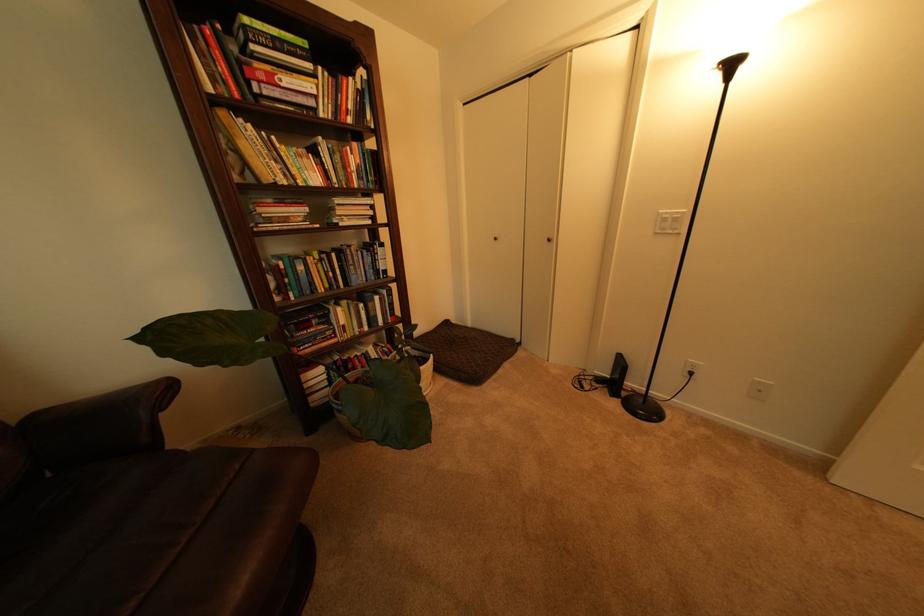
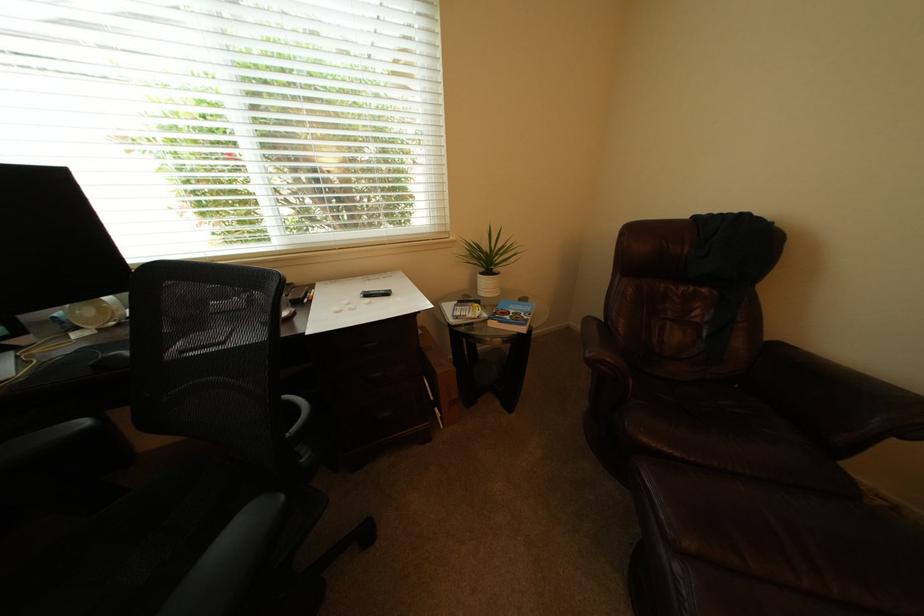
The images are taken continuously from a first-person perspective. In which direction is your viewpoint rotating?

The camera's rotation is toward left-down.